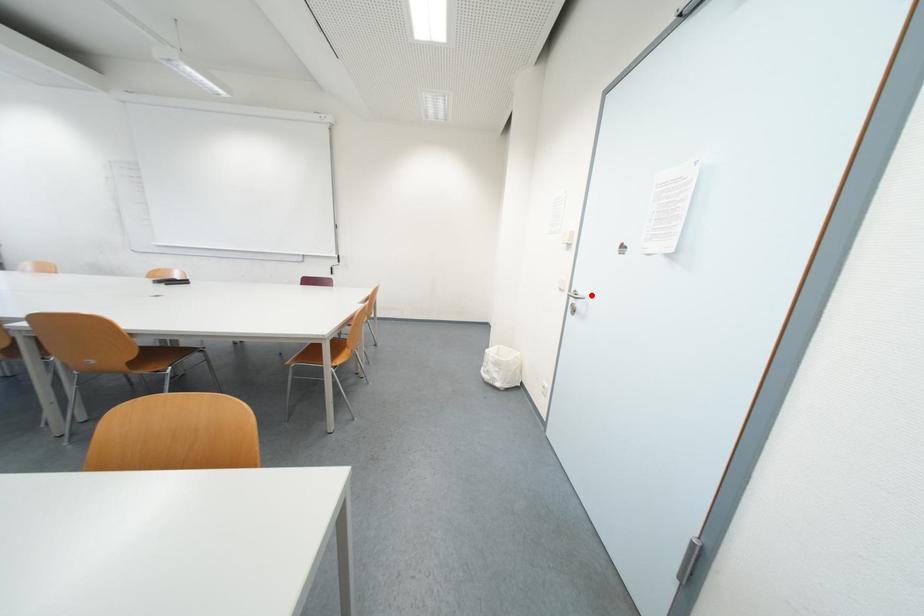
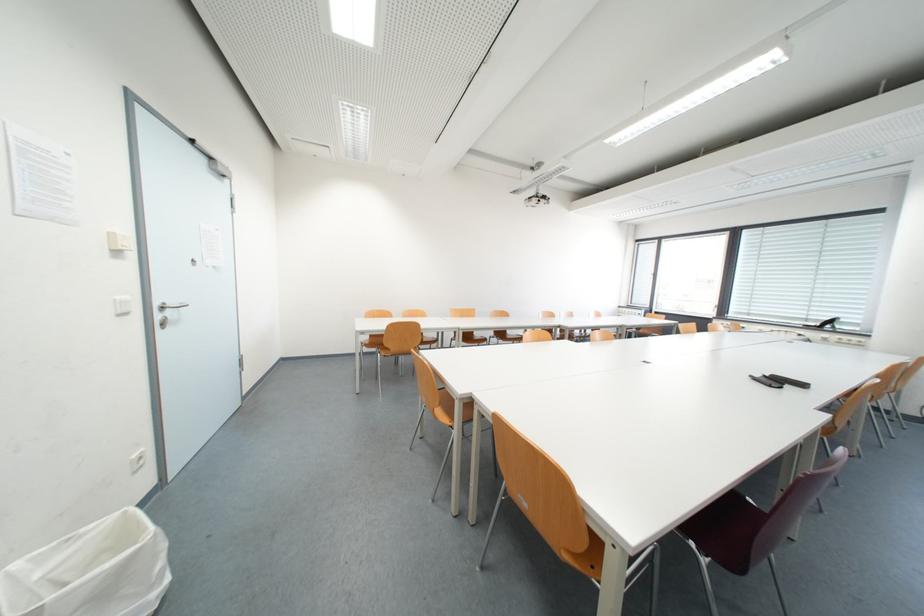
The point at the highlighted location is marked in the first image. Where is the corresponding point in the second image?

(178, 305)